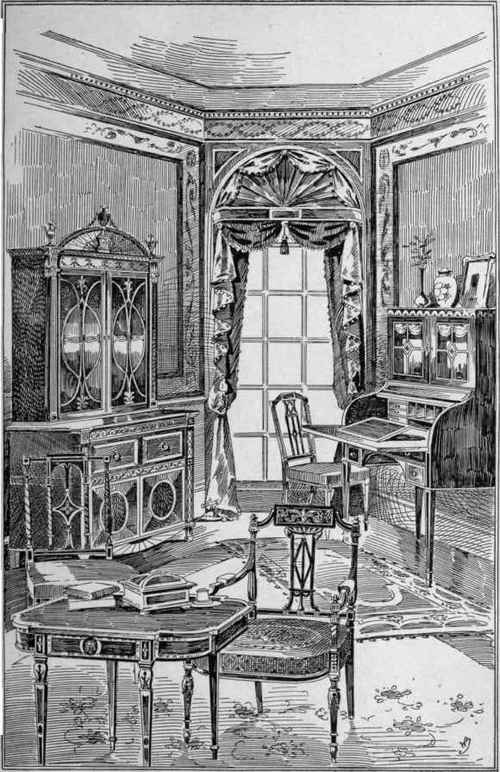
The height and width of the screenshot is (772, 500). In order to click on right drawer in this screenshot , I will do `click(155, 445)`.